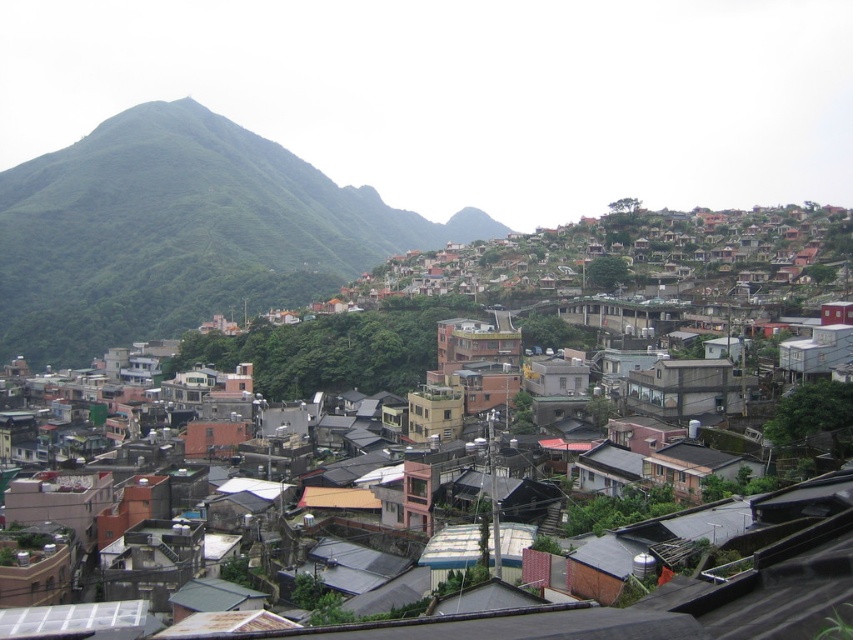
You are standing at the bottom of the hill looking up at the green leafy mountain at upper left and the matte gray buildings at center. Which structure is closer to you?

The green leafy mountain at upper left is closer to you because the matte gray buildings at center are positioned behind it.

Looking at this image, you are standing at the point with coordinates point (589, 321) and want to walk to the point with coordinates point (100, 333). Given the steep slope of the hillside, will you be walking uphill or downhill?

Since point (100, 333) is behind point (589, 321), you will be walking uphill towards it.

You are standing at the base of the green leafy mountain at upper left and want to reach the matte gray buildings at center. Which direction should you head towards?

Since the green leafy mountain at upper left is to the left of matte gray buildings at center, you should head towards the right to reach the matte gray buildings at center from the mountain.